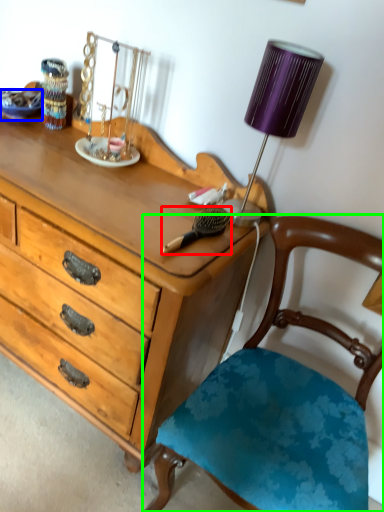
Question: Considering the real-world distances, which object is farthest from brush (highlighted by a red box)? plate (highlighted by a blue box) or chair (highlighted by a green box)?

Choices:
 (A) plate
 (B) chair

Answer: (A)